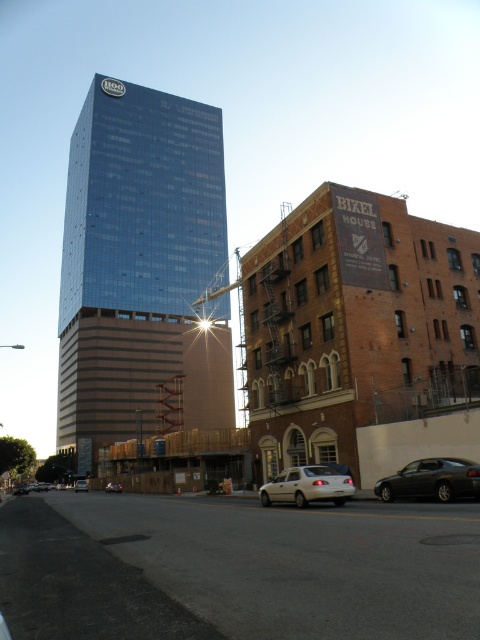
You are standing in the urban scene and want to take a photo of the point at coordinates (453, 497). If your camera has a maximum focus range of 20 meters, will you be able to focus on that point?

The distance of point (453, 497) from the camera is 17.41 meters, which is within the camera maximum focus range of 20 meters. Therefore, you can focus on that point.

You are standing in the urban scene described. You need to park your car, which is 15 feet long, in the closest available space. The closest parking space is located between the silver metallic sedan at lower left and the viewer. Is there enough space for your car to fit?

The distance between the silver metallic sedan at lower left and the viewer is 274.46 feet. Since your car is only 15 feet long, there is more than enough space to park your car in the closest available space between them.

Consider the image. You are a delivery driver who needs to park your vehicle between the two sedans. The parking spot is designed to accommodate vehicles no wider than 1.8 meters. Can you safely park your vehicle between the white matte sedan at lower center and the silver metallic sedan at lower left without exceeding the width limit?

The white matte sedan at lower center is closer to the viewer than the silver metallic sedan at lower left. However, the width of the sedans is not provided in the description, so it is impossible to determine if parking between them would exceed the 1.8 meter width limit. Additional information about the vehicles width is required to make a safe decision.